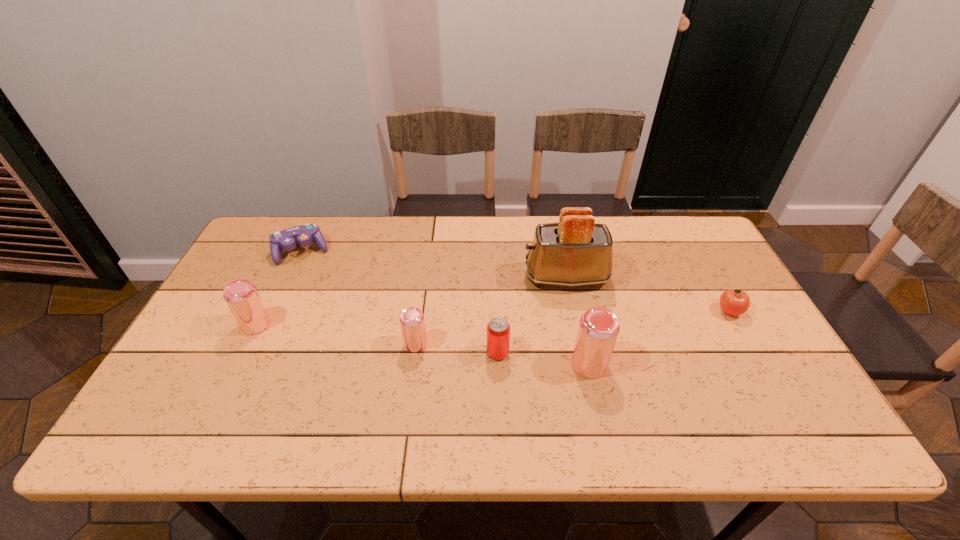
I want to click on can, so click(x=498, y=329).

Where is `vacant space positioned on the front of the third tallest object`? The width and height of the screenshot is (960, 540). vacant space positioned on the front of the third tallest object is located at coordinates (216, 407).

You are a GUI agent. You are given a task and a screenshot of the screen. Output one action in this format:
    pyautogui.click(x=<x>, y=<y>)
    Task: Click on the free location located 0.120m on the left of the second beer can from right to left
    
    Given the screenshot: What is the action you would take?
    pyautogui.click(x=358, y=343)

You are a GUI agent. You are given a task and a screenshot of the screen. Output one action in this format:
    pyautogui.click(x=<x>, y=<y>)
    Task: Click on the blank space located on the left of the rightmost beer can
    Image resolution: width=960 pixels, height=540 pixels.
    Given the screenshot: What is the action you would take?
    click(414, 364)

I want to click on free location located 0.400m on the side of the toaster with the control lever, so click(390, 278).

Locate an element on the screen. vacant region located 0.370m on the side of the toaster with the control lever is located at coordinates (399, 278).

Identify the location of vacant position located on the side of the toaster with the control lever. (486, 278).

Identify the location of vacant space located 0.280m on the right of the control. The height and width of the screenshot is (540, 960). (416, 251).

The height and width of the screenshot is (540, 960). I want to click on free region located 0.220m on the back of the rightmost object, so click(x=697, y=253).

Locate an element on the screen. This screenshot has width=960, height=540. vacant space located on the back of the can is located at coordinates (495, 295).